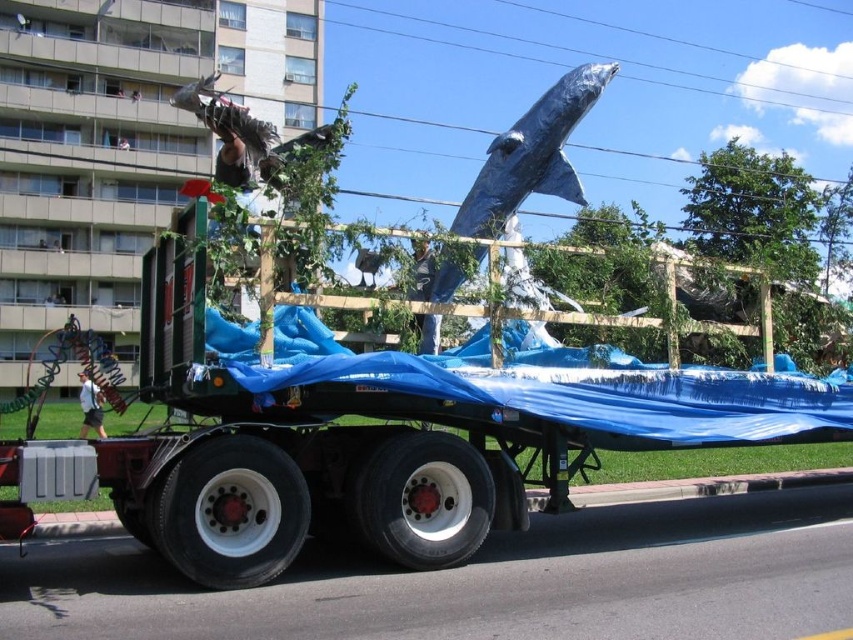
Question: Which object appears closest to the camera in this image?

Choices:
 (A) blue metallic whale at upper center
 (B) green leafy tree at upper right

Answer: (A)

Question: Does green leafy tree at upper right lie in front of blue metallic whale at upper center?

Choices:
 (A) no
 (B) yes

Answer: (A)

Question: Is green leafy tree at upper right to the right of blue metallic whale at upper center from the viewer's perspective?

Choices:
 (A) no
 (B) yes

Answer: (B)

Question: Observing the image, what is the correct spatial positioning of green leafy tree at upper right in reference to blue metallic whale at upper center?

Choices:
 (A) above
 (B) below

Answer: (A)

Question: Which point is closer to the camera?

Choices:
 (A) (795, 228)
 (B) (564, 83)

Answer: (B)